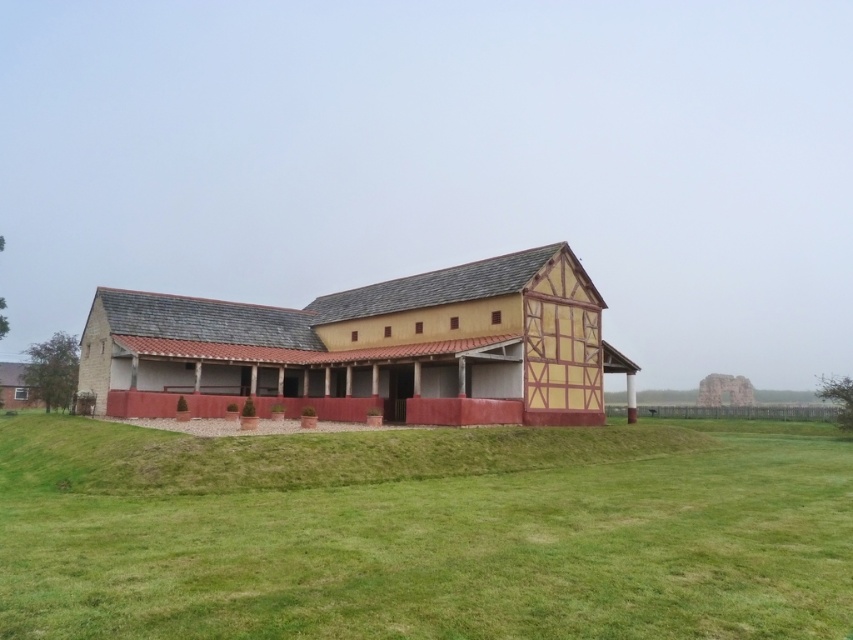
Question: Which point is farther to the camera?

Choices:
 (A) wooden barn at center
 (B) green grass at center

Answer: (A)

Question: Considering the relative positions of green grass at center and wooden barn at center in the image provided, where is green grass at center located with respect to wooden barn at center?

Choices:
 (A) left
 (B) right

Answer: (B)

Question: Observing the image, what is the correct spatial positioning of green grass at center in reference to wooden barn at center?

Choices:
 (A) right
 (B) left

Answer: (A)

Question: Is green grass at center further to the viewer compared to wooden barn at center?

Choices:
 (A) no
 (B) yes

Answer: (A)

Question: Which point is farther from the camera taking this photo?

Choices:
 (A) (751, 566)
 (B) (352, 406)

Answer: (B)